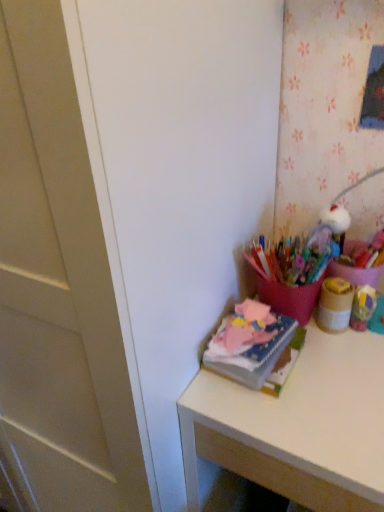
Question: From the image's perspective, is soft pink fabric at upper right located above or below matte pink desk at right?

Choices:
 (A) above
 (B) below

Answer: (A)

Question: Is point coord(274,336) positioned closer to the camera than point coord(365,349)?

Choices:
 (A) farther
 (B) closer

Answer: (B)

Question: Which of these objects is positioned farthest from the soft pink fabric at upper right?

Choices:
 (A) matte pink desk at right
 (B) matte brown jar at upper right

Answer: (B)

Question: Estimate the real-world distances between objects in this image. Which object is farther from the soft pink fabric at upper right?

Choices:
 (A) matte pink desk at right
 (B) matte brown jar at upper right

Answer: (B)